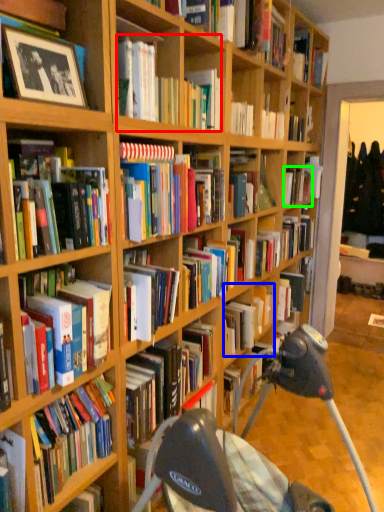
Question: Which object is positioned farthest from book (highlighted by a red box)? Select from book (highlighted by a blue box) and book (highlighted by a green box).

Choices:
 (A) book
 (B) book

Answer: (B)